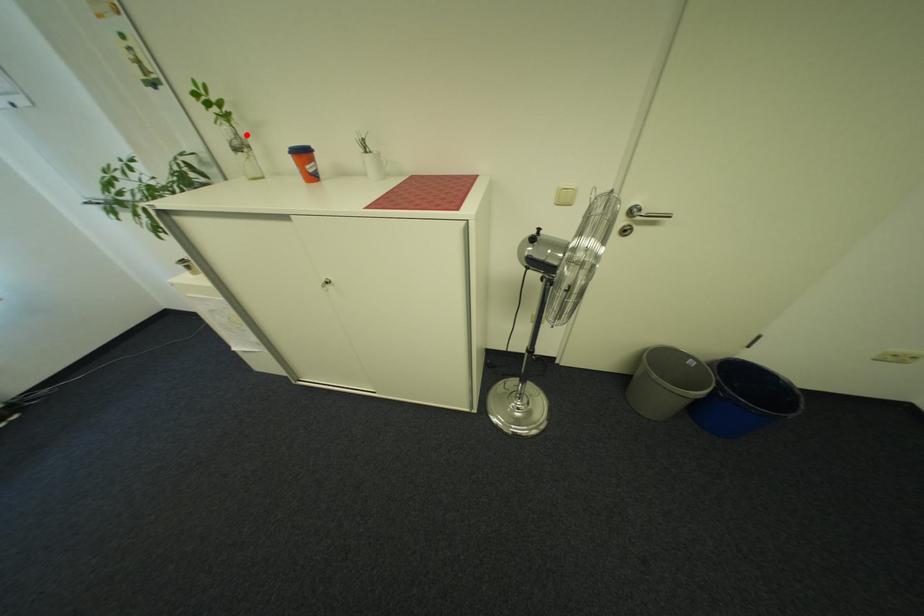
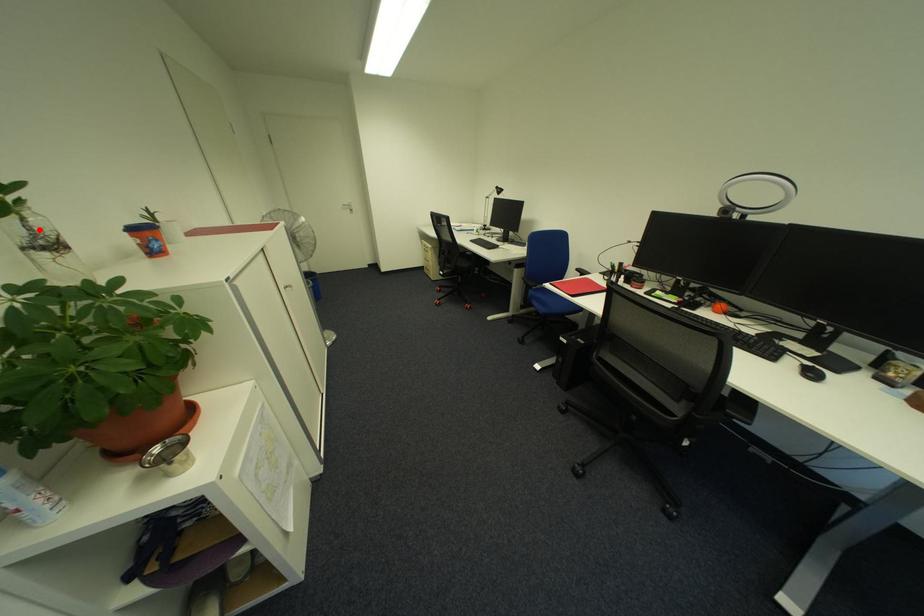
I am providing you with two images of the same scene from different viewpoints. A red point is marked on the first image and another point is marked on the second image. Is the marked point in image1 the same physical position as the marked point in image2?

Yes